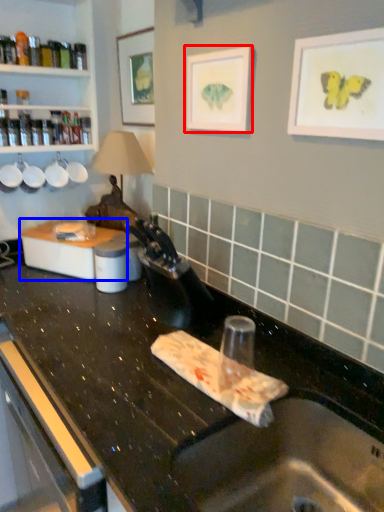
Question: Which of the following is the closest to the observer, picture frame (highlighted by a red box) or appliance (highlighted by a blue box)?

Choices:
 (A) picture frame
 (B) appliance

Answer: (A)